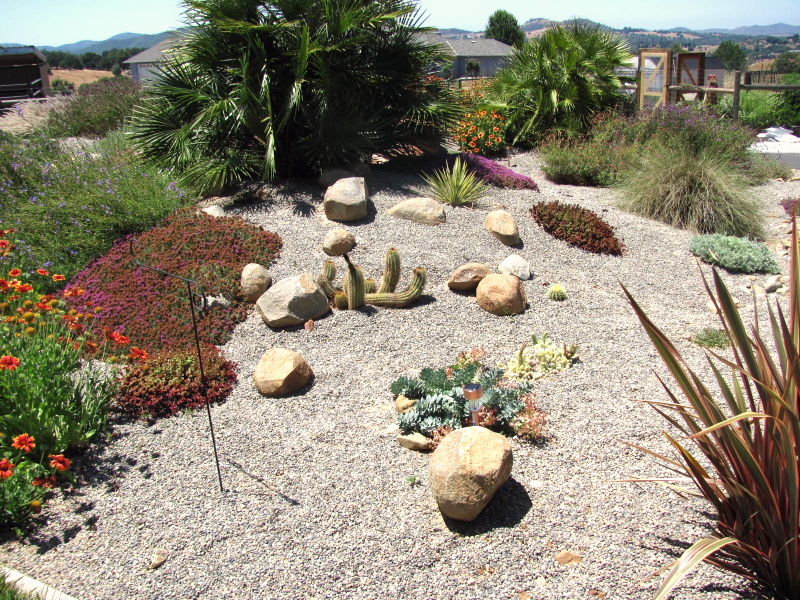
Where is `orange flowers`? The height and width of the screenshot is (600, 800). orange flowers is located at coordinates (30, 462), (26, 377), (26, 304), (10, 248), (10, 337), (90, 345), (116, 339).